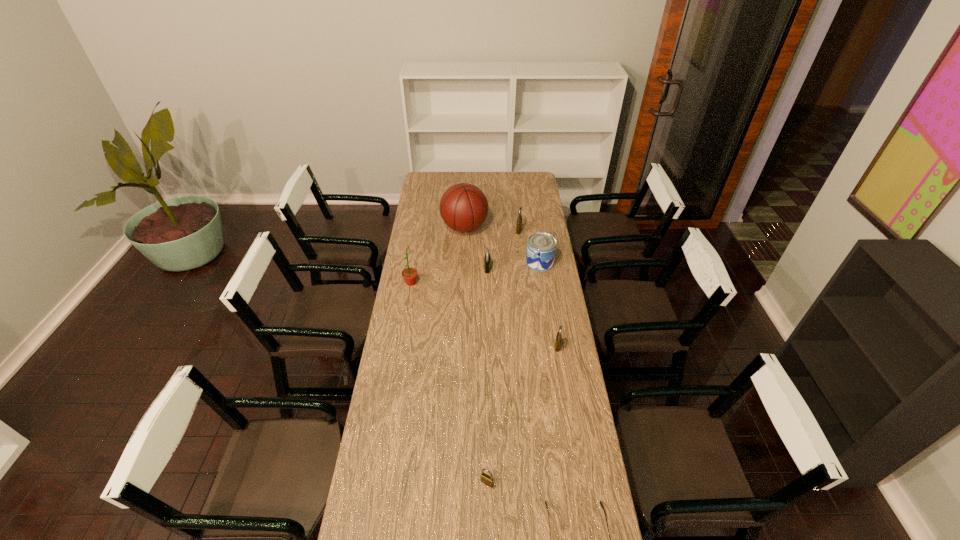
In order to click on vacant area between the third nearest padlock and the fifth farthest object in this screenshot , I will do [x=449, y=275].

The height and width of the screenshot is (540, 960). In order to click on empty space that is in between the second farthest padlock and the sunflower in this screenshot , I will do `click(449, 275)`.

You are a GUI agent. You are given a task and a screenshot of the screen. Output one action in this format:
    pyautogui.click(x=<x>, y=<y>)
    Task: Click on the vacant area that lies between the farthest brass padlock and the brown basketball
    This screenshot has height=540, width=960.
    Given the screenshot: What is the action you would take?
    pyautogui.click(x=492, y=229)

Locate which object ranks sixth in proximity to the smallest brass padlock. Please provide its 2D coordinates. Your answer should be formatted as a tuple, i.e. [(x, y)], where the tuple contains the x and y coordinates of a point satisfying the conditions above.

[(463, 207)]

Find the location of a particular element. This screenshot has width=960, height=540. object that ranks as the seventh closest to the biggest brass padlock is located at coordinates click(x=601, y=504).

Select which padlock is the third closest to the second farthest padlock. Please provide its 2D coordinates. Your answer should be formatted as a tuple, i.e. [(x, y)], where the tuple contains the x and y coordinates of a point satisfying the conditions above.

[(488, 480)]

Select which padlock is the second closest to the farthest brass padlock. Please provide its 2D coordinates. Your answer should be formatted as a tuple, i.e. [(x, y)], where the tuple contains the x and y coordinates of a point satisfying the conditions above.

[(559, 336)]

Locate an element on the screen. The height and width of the screenshot is (540, 960). brass padlock that can be found as the closest to the fifth farthest object is located at coordinates (519, 220).

At what (x,y) coordinates should I click in order to perform the action: click on the closest brass padlock to the second farthest padlock. Please return your answer as a coordinate pair (x, y). Looking at the image, I should click on (519, 220).

What are the coordinates of `vacant space that satisfies the following two spatial constraints: 1. on the front label of the blue can; 2. on the right side of the second nearest padlock` in the screenshot? It's located at (552, 346).